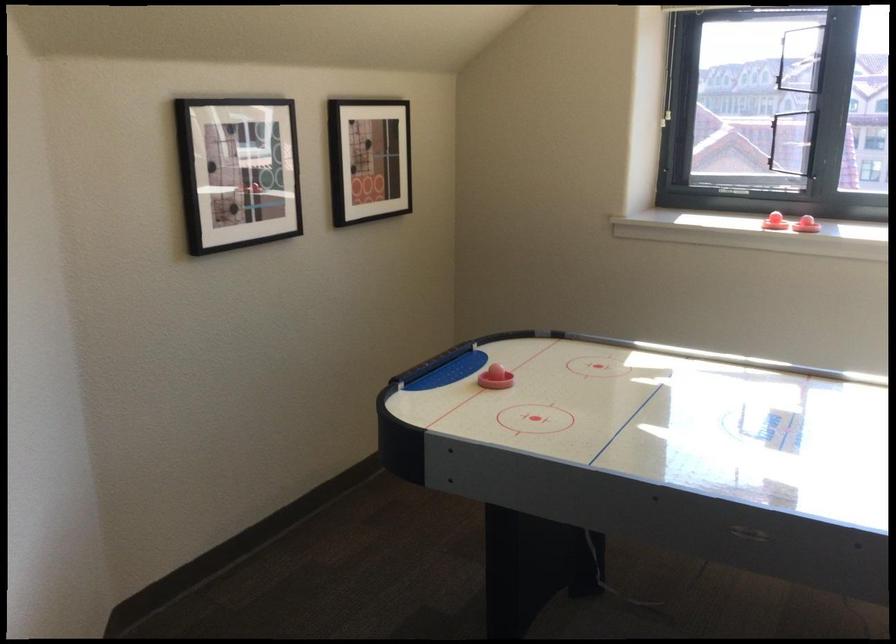
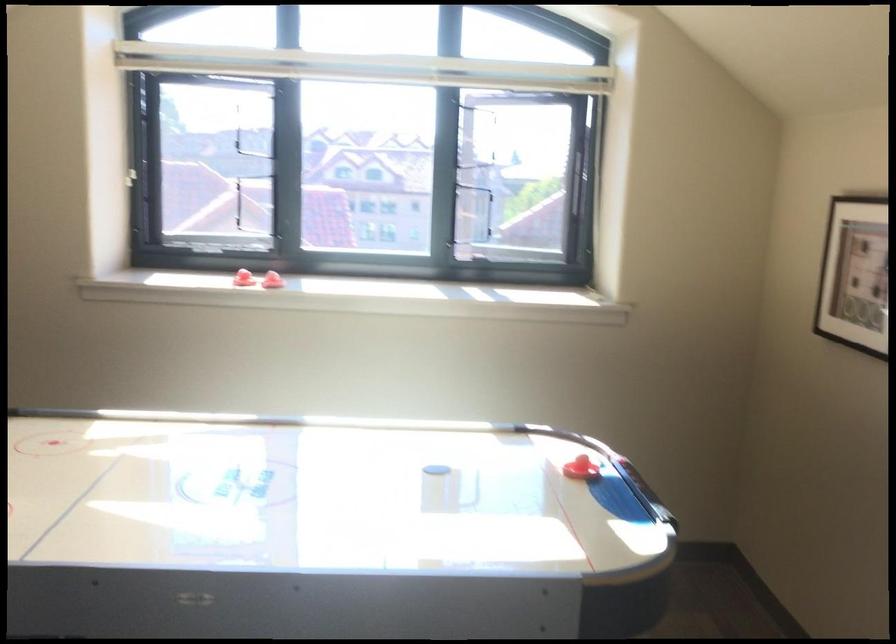
Find the pixel in the second image that matches the point at 685,77 in the first image.

(143, 144)